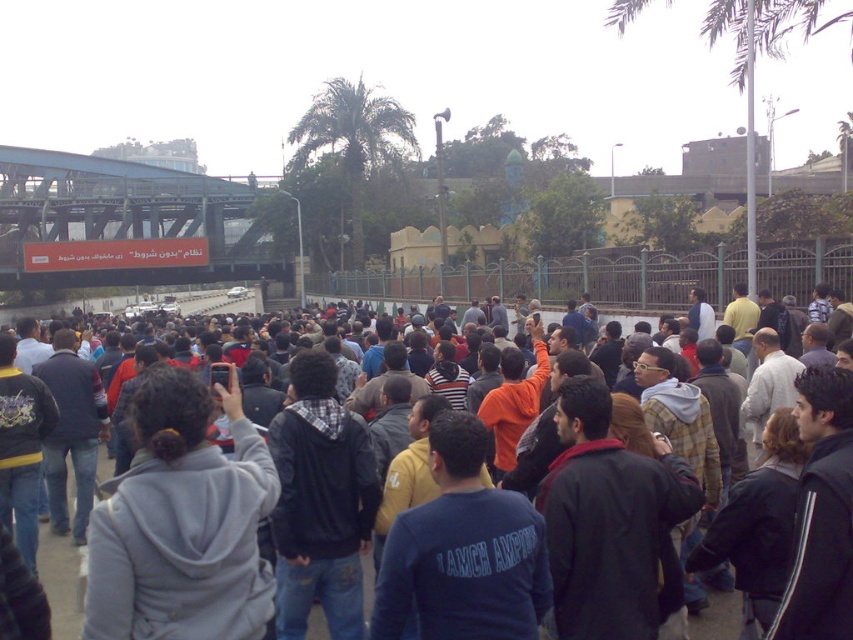
Question: Can you confirm if green leafy palm tree at upper center is positioned to the left of dark gray hoodie at center?

Choices:
 (A) yes
 (B) no

Answer: (B)

Question: Which of the following is the closest to the observer?

Choices:
 (A) dark gray hoodie at center
 (B) green leafy palm tree at upper center

Answer: (A)

Question: Does green leafy palm tree at upper center have a smaller size compared to dark gray hoodie at center?

Choices:
 (A) no
 (B) yes

Answer: (B)

Question: Is green leafy palm tree at upper center below dark gray hoodie at center?

Choices:
 (A) no
 (B) yes

Answer: (A)

Question: Among these points, which one is nearest to the camera?

Choices:
 (A) (59, 612)
 (B) (395, 129)

Answer: (A)